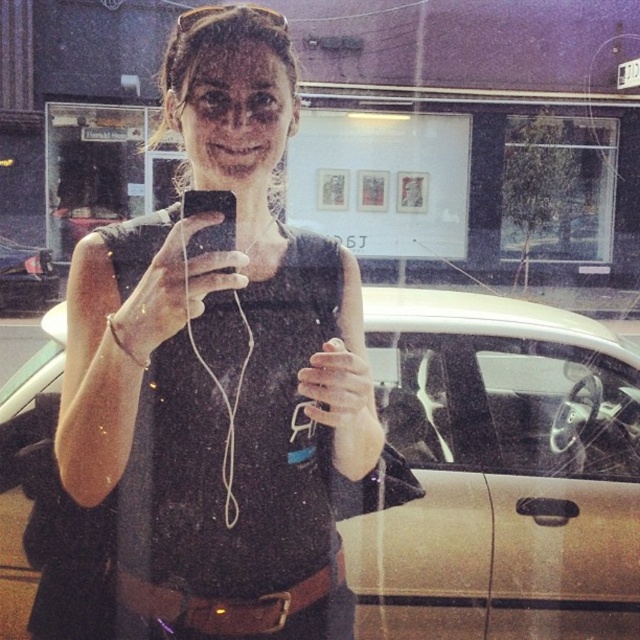
Question: Which point appears closest to the camera in this image?

Choices:
 (A) (225, 225)
 (B) (260, 490)
 (C) (518, 470)

Answer: (A)

Question: Which of the following is the closest to the observer?

Choices:
 (A) (230, 202)
 (B) (394, 444)
 (C) (324, 349)
 (D) (556, 468)

Answer: (A)

Question: Can you confirm if black matte tank top at center is positioned to the left of gold metallic car at center?

Choices:
 (A) no
 (B) yes

Answer: (B)

Question: Can you confirm if transparent glass steering wheel at center is smaller than matte black phone at center?

Choices:
 (A) no
 (B) yes

Answer: (A)

Question: Estimate the real-world distances between objects in this image. Which object is closer to the black matte tank top at center?

Choices:
 (A) transparent glass steering wheel at center
 (B) gold metallic car at center

Answer: (B)

Question: Can you confirm if black matte tank top at center is thinner than matte black phone at center?

Choices:
 (A) no
 (B) yes

Answer: (A)